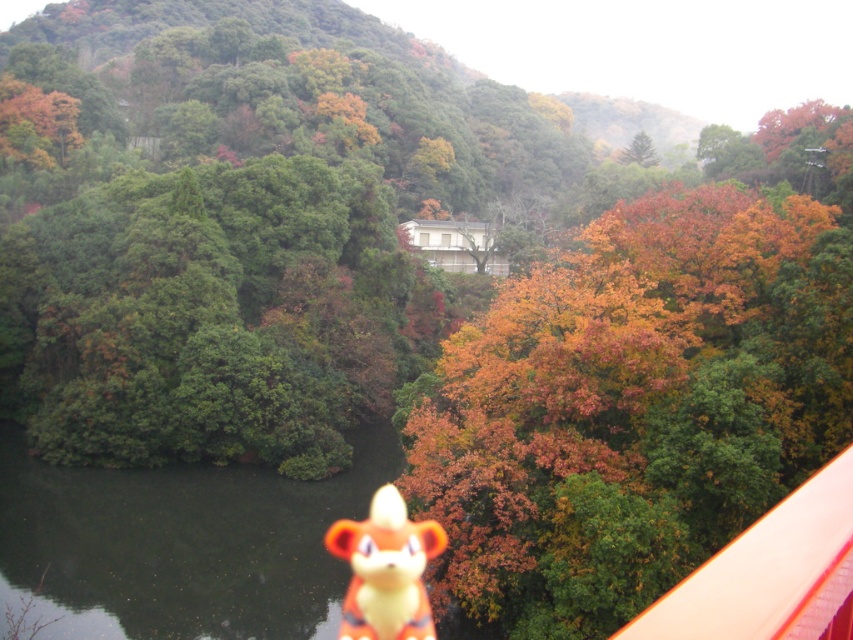
Question: Which point is closer to the camera?

Choices:
 (A) coord(340,538)
 (B) coord(473,358)

Answer: (B)

Question: Is the position of autumn leaves at center more distant than that of orange plush toy at center?

Choices:
 (A) yes
 (B) no

Answer: (B)

Question: Which object is closer to the camera taking this photo?

Choices:
 (A) autumn leaves at center
 (B) orange plush toy at center

Answer: (A)

Question: Which point is farther to the camera?

Choices:
 (A) (514, 301)
 (B) (425, 634)

Answer: (A)

Question: Does autumn leaves at center have a smaller size compared to orange plush toy at center?

Choices:
 (A) yes
 (B) no

Answer: (B)

Question: Does autumn leaves at center appear on the left side of orange plush toy at center?

Choices:
 (A) yes
 (B) no

Answer: (B)